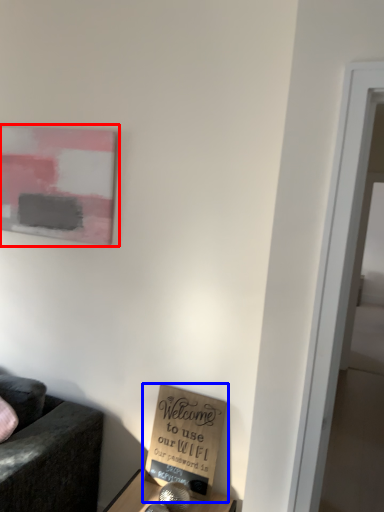
Question: Which point is further to the camera, picture frame (highlighted by a red box) or cardboard box (highlighted by a blue box)?

Choices:
 (A) picture frame
 (B) cardboard box

Answer: (A)